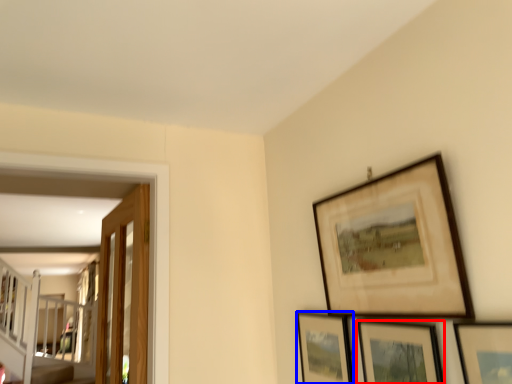
Question: Which object appears farthest to the camera in this image, picture frame (highlighted by a red box) or picture frame (highlighted by a blue box)?

Choices:
 (A) picture frame
 (B) picture frame

Answer: (B)